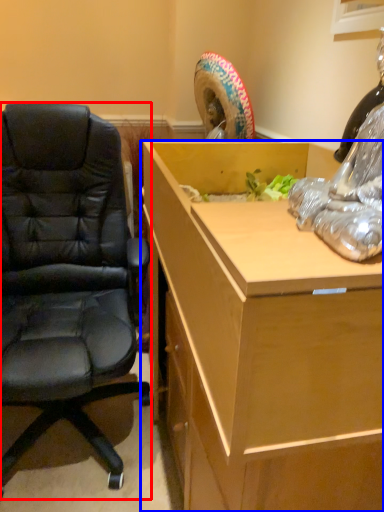
Question: Which of the following is the farthest to the observer, chair (highlighted by a red box) or desk (highlighted by a blue box)?

Choices:
 (A) chair
 (B) desk

Answer: (A)